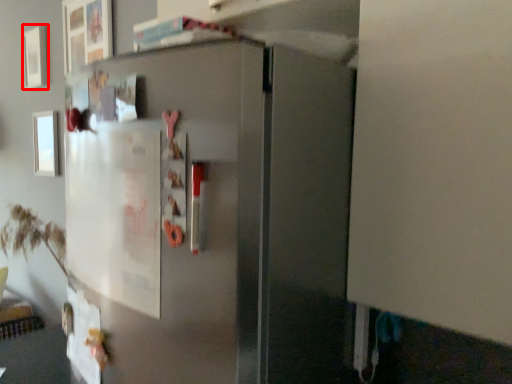
Question: From the image's perspective, considering the relative positions of picture frame (annotated by the red box) and picture frame in the image provided, where is picture frame (annotated by the red box) located with respect to the staircase?

Choices:
 (A) above
 (B) below

Answer: (A)